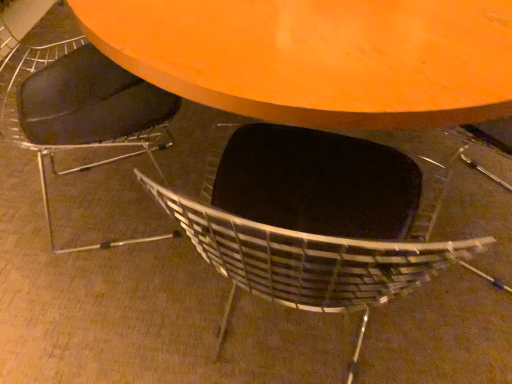
Identify the location of spots to the right of black leather chair at center, the first chair in the right-to-left sequence. (433, 331).